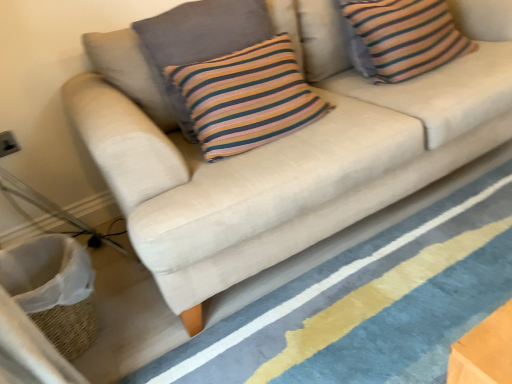
Question: Is white woven basket at lower left inside the boundaries of beige fabric sofa at lower center, or outside?

Choices:
 (A) outside
 (B) inside

Answer: (A)

Question: From the image's perspective, is white woven basket at lower left positioned above or below beige fabric sofa at lower center?

Choices:
 (A) below
 (B) above

Answer: (A)

Question: Which is farther from the striped cotton cushion at upper right, which is the 2th pillow in left-to-right order?

Choices:
 (A) knitted cotton pillow at center, the 2th pillow in the right-to-left sequence
 (B) beige fabric sofa at lower center
 (C) white woven basket at lower left

Answer: (C)

Question: Which of these objects is positioned farthest from the striped cotton cushion at upper right, which is the 2th pillow in left-to-right order?

Choices:
 (A) knitted cotton pillow at center, marked as the first pillow in a left-to-right arrangement
 (B) beige fabric sofa at lower center
 (C) white woven basket at lower left

Answer: (C)